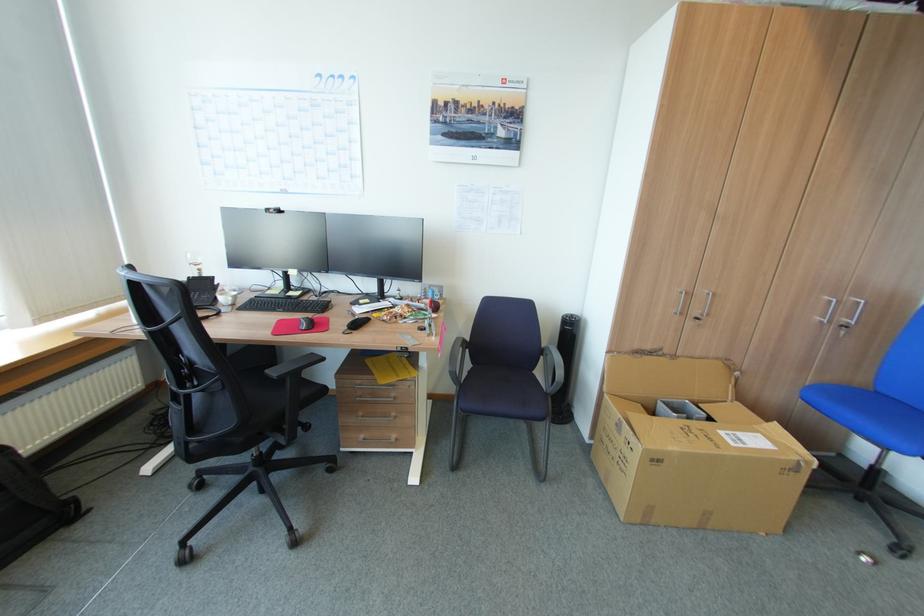
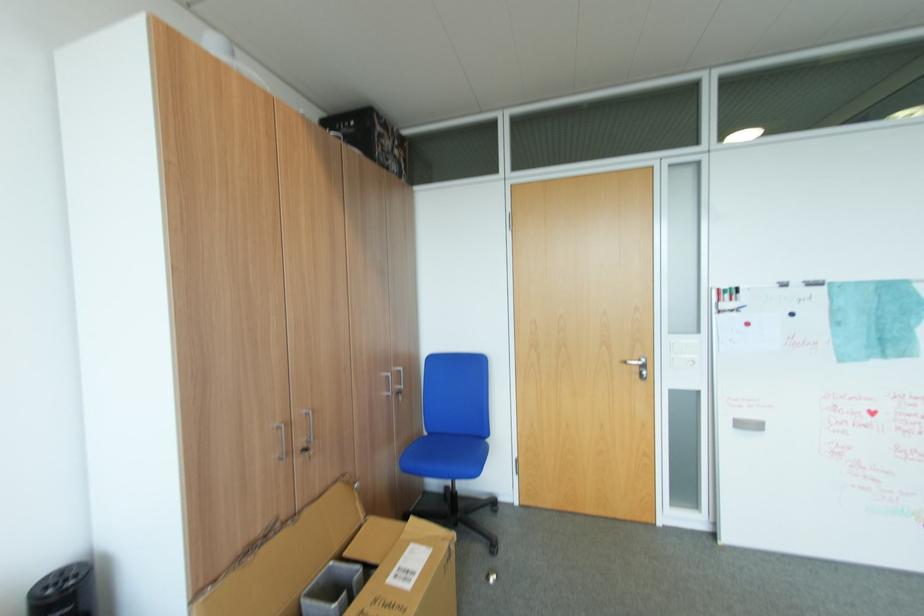
Find the pixel in the second image that matches point 701,318 in the first image.

(310, 451)